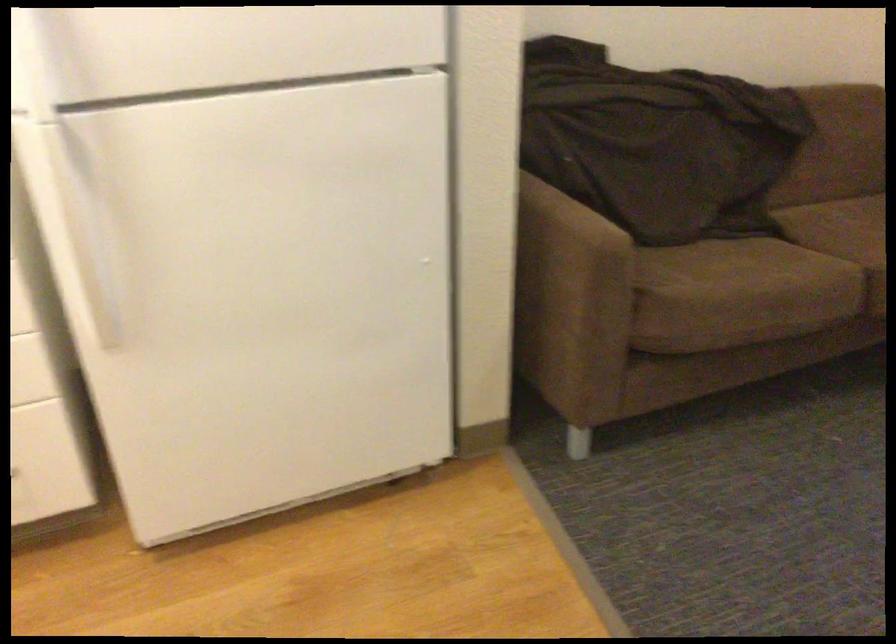
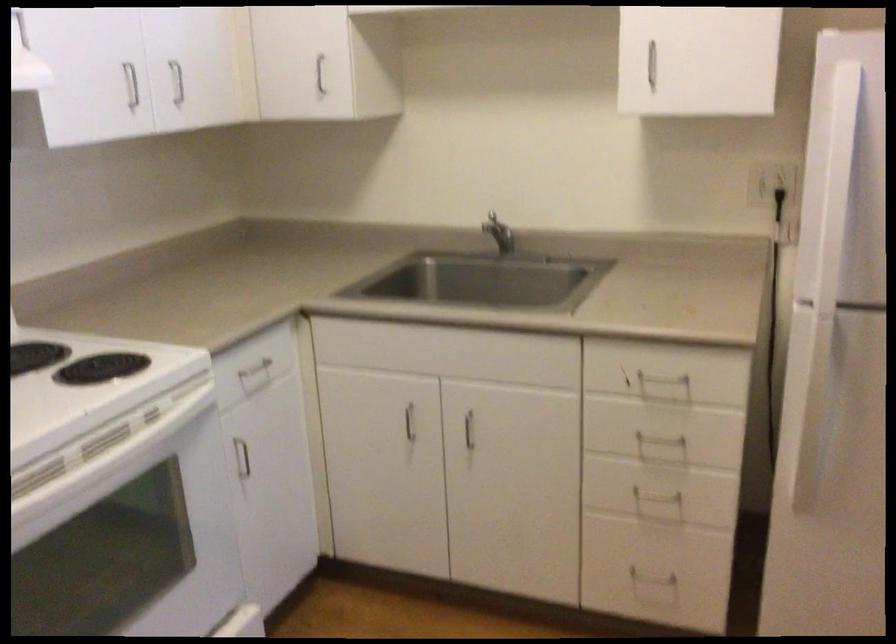
Question: The first image is from the beginning of the video and the second image is from the end. How did the camera likely rotate when shooting the video?

Choices:
 (A) Left
 (B) Right
 (C) Up
 (D) Down

Answer: (A)